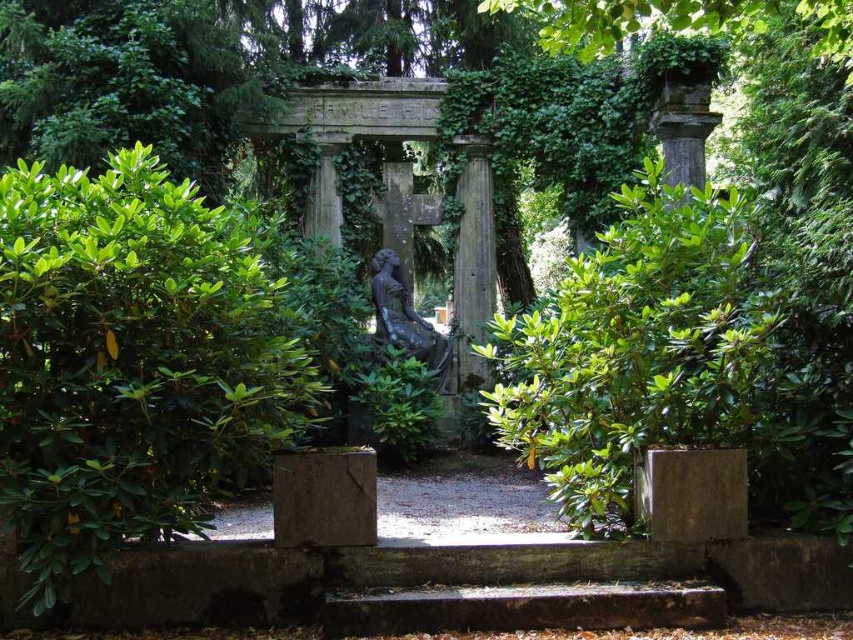
Between point (480, 333) and point (430, 369), which one is positioned behind?

The point (480, 333) is more distant.

Consider the image. Who is more forward, (x=486, y=243) or (x=392, y=280)?

Point (x=392, y=280)

Which is in front, point (459, 349) or point (393, 342)?

Positioned in front is point (393, 342).

Where is `stone column at center`? Image resolution: width=853 pixels, height=640 pixels. stone column at center is located at coordinates (473, 262).

Can you confirm if green leafy bush at center is taller than bronze statue at center?

Indeed, green leafy bush at center has a greater height compared to bronze statue at center.

Looking at this image, does green leafy bush at center come in front of bronze statue at center?

Yes.

Locate an element on the screen. The image size is (853, 640). green leafy bush at center is located at coordinates (132, 360).

Locate an element on the screen. green leafy bush at center is located at coordinates (132, 360).

Which is in front, point (96, 188) or point (476, 218)?

Point (96, 188) is in front.

Can you confirm if green leafy bush at center is bigger than stone column at center?

Yes.

The width and height of the screenshot is (853, 640). I want to click on green leafy bush at center, so click(132, 360).